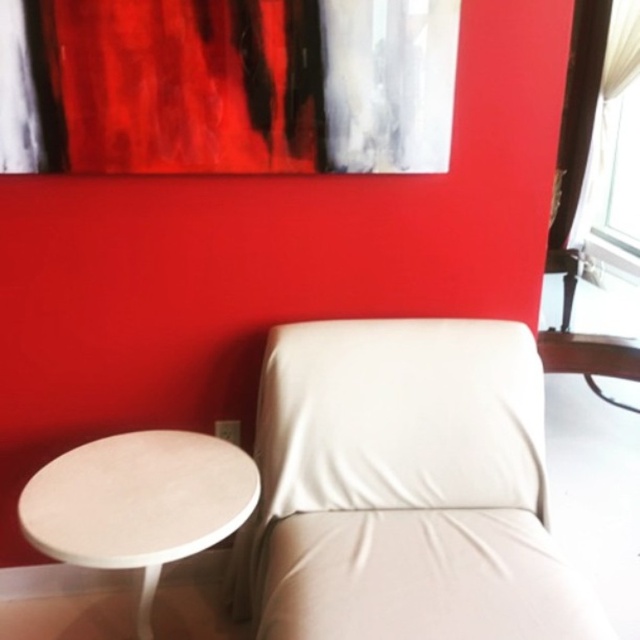
Question: Does white leather armchair at lower right appear over white matte table at lower left?

Choices:
 (A) no
 (B) yes

Answer: (B)

Question: Which of the following is the closest to the observer?

Choices:
 (A) white leather armchair at lower right
 (B) white matte table at lower left

Answer: (A)

Question: Is white leather armchair at lower right below white matte table at lower left?

Choices:
 (A) no
 (B) yes

Answer: (A)

Question: Is white leather armchair at lower right thinner than white matte table at lower left?

Choices:
 (A) yes
 (B) no

Answer: (B)